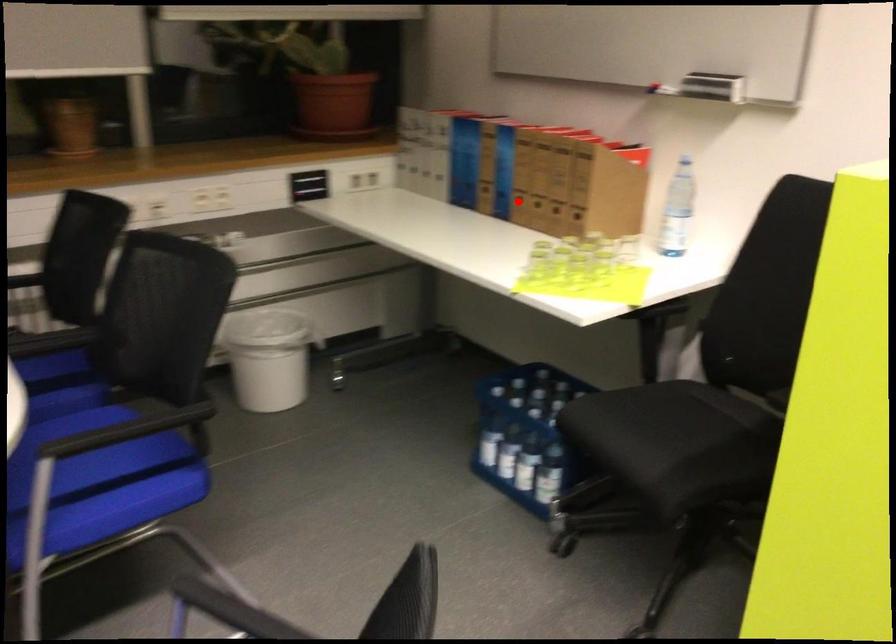
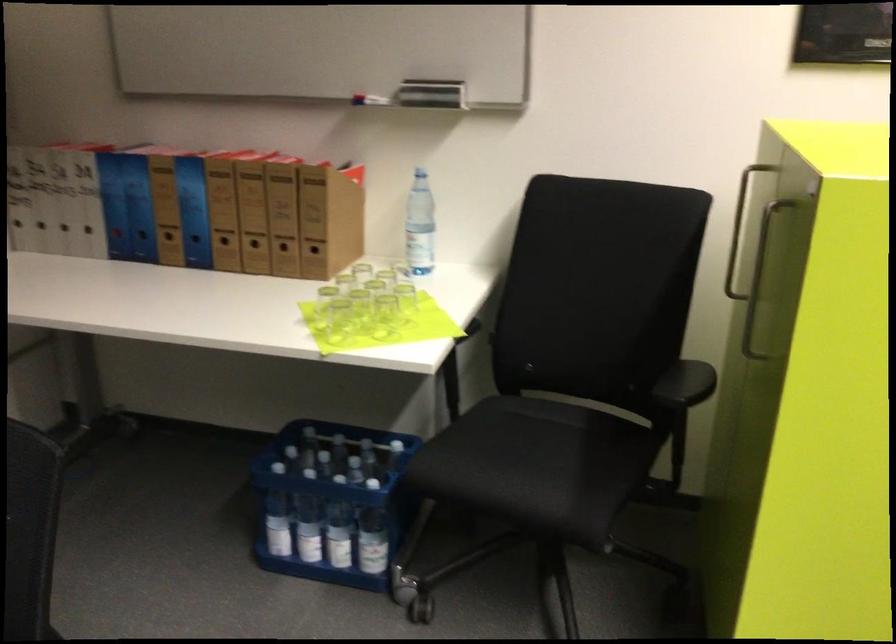
Question: I am providing you with two images of the same scene from different viewpoints. In image1, a red point is highlighted. Considering the same 3D point in image2, which of the following is correct?

Choices:
 (A) It is closer
 (B) It is farther

Answer: (A)